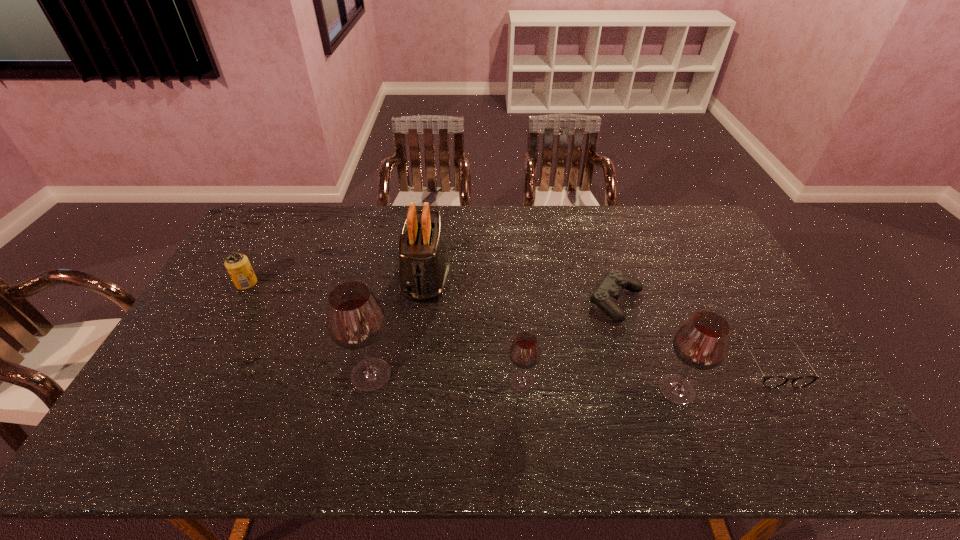
The width and height of the screenshot is (960, 540). I want to click on vacant spot to place a wineglass on the left, so click(x=225, y=368).